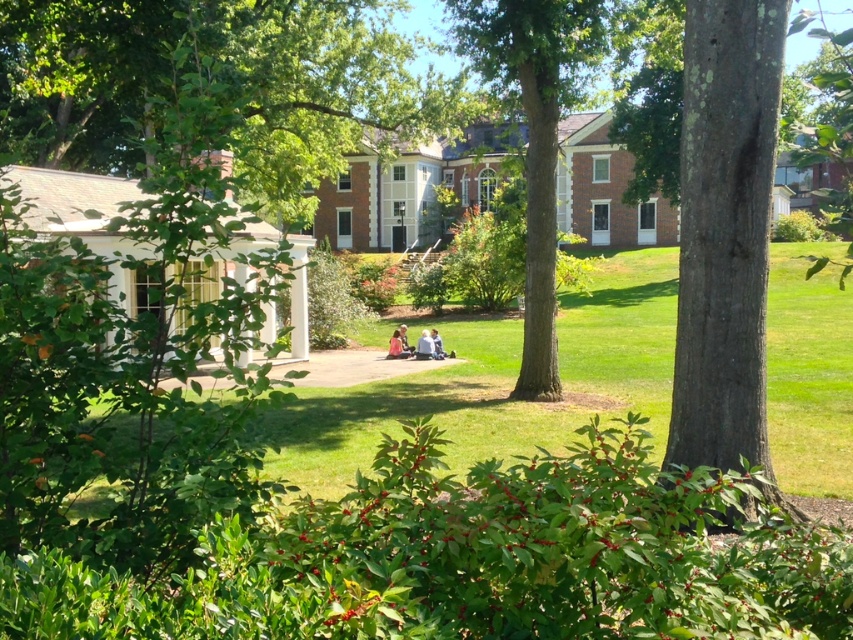
Consider the image. You are standing at the point marked by coordinates point (424, 346). What object is located exactly at this point?

The point (424, 346) marks the location of the light brown leather jacket at center.

You are standing at the edge of the pathway and want to take a photo of both the green textured tree at center and the light blue denim jeans at center. Since you can only focus on one object at a time, which one should you focus on to ensure the other appears in the background?

You should focus on the green textured tree at center because it is closer to the viewer than the light blue denim jeans at center, so the jeans will naturally appear in the background when the tree is in focus.

You are a photographer standing in the scene. You want to take a photo of the light blue denim jeans at center without the green textured tree at center appearing in the background. Is this possible based on their positions?

The green textured tree at center is above the light blue denim jeans at center, so if you position yourself directly in front of the light blue denim jeans at center and angle the camera downward, the tree would not be visible in the background. This should allow you to capture the jeans without the tree obstructing the shot.